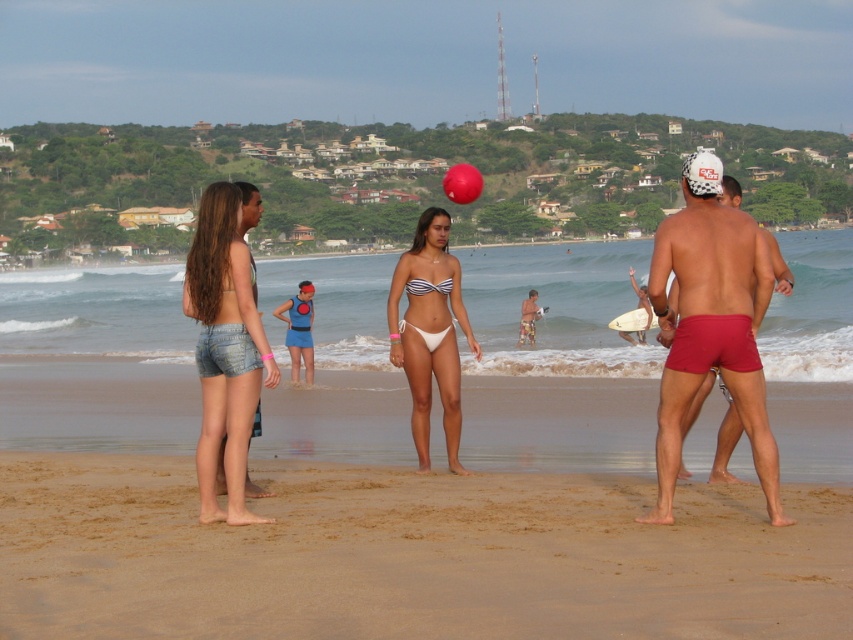
Question: Which of the following is the closest to the observer?

Choices:
 (A) white matte bikini at center
 (B) red matte shorts at center

Answer: (B)

Question: Is white matte bikini at center further to the viewer compared to rubber volleyball at center?

Choices:
 (A) no
 (B) yes

Answer: (A)

Question: Estimate the real-world distances between objects in this image. Which object is closer to the brown sandy beach at lower center?

Choices:
 (A) denim shorts at left
 (B) rubber volleyball at center
 (C) white matte bikini at center
 (D) white striped bikini at center

Answer: (A)

Question: Which point appears farthest from the camera in this image?

Choices:
 (A) (207, 243)
 (B) (666, 435)
 (C) (415, 250)
 (D) (436, 337)

Answer: (C)

Question: In this image, where is brown sandy beach at lower center located relative to white striped bikini at center?

Choices:
 (A) left
 (B) right

Answer: (B)

Question: Is denim shorts at left thinner than white striped bikini at center?

Choices:
 (A) no
 (B) yes

Answer: (A)